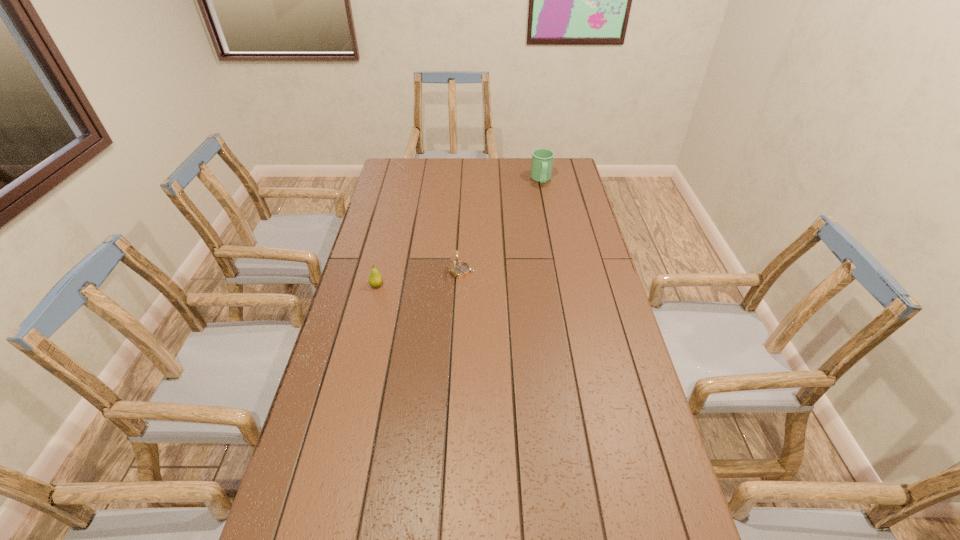
Image resolution: width=960 pixels, height=540 pixels. What are the coordinates of `vacant point located between the mug and the compass` in the screenshot? It's located at (501, 226).

Locate an element on the screen. free point between the tallest object and the leftmost object is located at coordinates (459, 232).

Locate an element on the screen. object that is the second closest one to the tallest object is located at coordinates (375, 279).

Locate which object is the closest to the nearest object. Please provide its 2D coordinates. Your answer should be formatted as a tuple, i.e. [(x, y)], where the tuple contains the x and y coordinates of a point satisfying the conditions above.

[(460, 269)]

The width and height of the screenshot is (960, 540). I want to click on blank area in the image that satisfies the following two spatial constraints: 1. on the side of the rightmost object with the handle; 2. with the dial facing the second farthest object, so click(x=559, y=272).

The image size is (960, 540). Identify the location of vacant space that satisfies the following two spatial constraints: 1. on the side of the tallest object with the handle; 2. with the dial facing the second object from left to right. (559, 272).

I want to click on free point that satisfies the following two spatial constraints: 1. on the side of the rightmost object with the handle; 2. with the dial facing the second farthest object, so click(x=559, y=272).